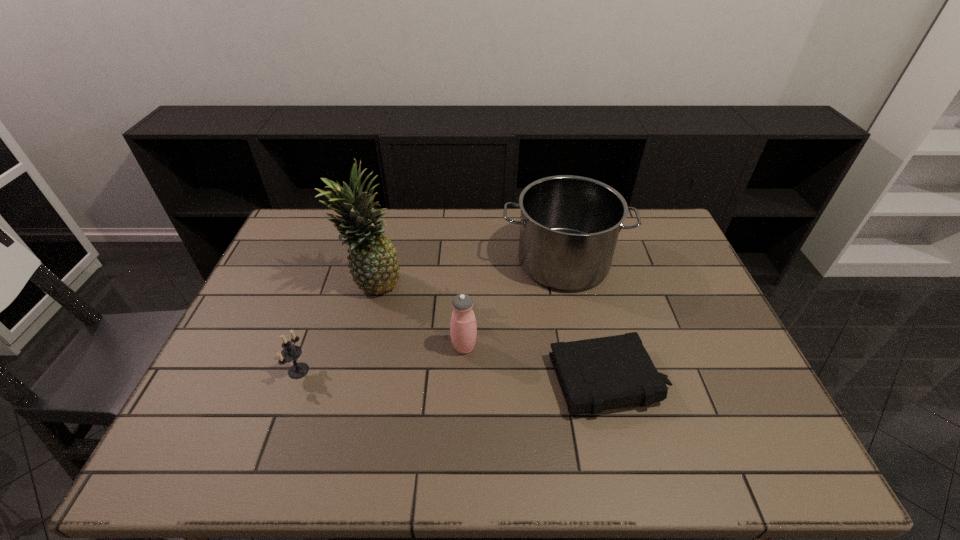
I want to click on vacant area between the saucepan and the Bible, so pyautogui.click(x=587, y=321).

At what (x,y) coordinates should I click in order to perform the action: click on unoccupied area between the third shortest object and the fourth tallest object. Please return your answer as a coordinate pair (x, y). Looking at the image, I should click on [x=381, y=359].

In order to click on free space between the third object from left to right and the leftmost object in this screenshot , I will do `click(381, 359)`.

What are the coordinates of `unoccupied area between the shortest object and the saucepan` in the screenshot? It's located at [x=587, y=321].

You are a GUI agent. You are given a task and a screenshot of the screen. Output one action in this format:
    pyautogui.click(x=<x>, y=<y>)
    Task: Click on the free spot between the candle holder and the saucepan
    Image resolution: width=960 pixels, height=540 pixels.
    Given the screenshot: What is the action you would take?
    pyautogui.click(x=431, y=316)

At what (x,y) coordinates should I click in order to perform the action: click on unoccupied area between the shortest object and the leftmost object. Please return your answer as a coordinate pair (x, y). Looking at the image, I should click on (454, 375).

Find the location of a particular element. Image resolution: width=960 pixels, height=540 pixels. vacant region between the Bible and the fourth object from right to left is located at coordinates (491, 333).

Where is `unoccupied position between the third shortest object and the Bible`? This screenshot has width=960, height=540. unoccupied position between the third shortest object and the Bible is located at coordinates (537, 363).

Locate an element on the screen. The width and height of the screenshot is (960, 540). free space between the thermos bottle and the saucepan is located at coordinates (514, 305).

The height and width of the screenshot is (540, 960). Identify the location of vacant area that lies between the Bible and the second object from left to right. (491, 333).